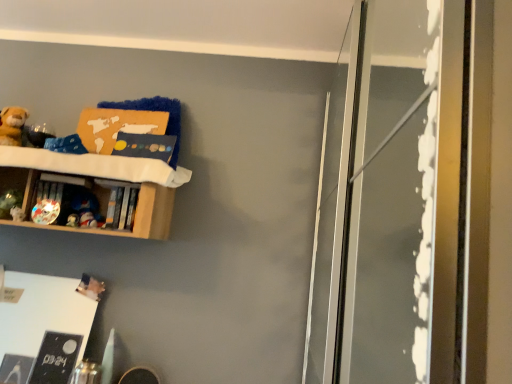
Question: From the image's perspective, is wooden shelf at upper left above white matte board at lower left?

Choices:
 (A) no
 (B) yes

Answer: (B)

Question: Considering the relative sizes of wooden shelf at upper left and white matte board at lower left in the image provided, is wooden shelf at upper left thinner than white matte board at lower left?

Choices:
 (A) yes
 (B) no

Answer: (B)

Question: From the image's perspective, is wooden shelf at upper left below white matte board at lower left?

Choices:
 (A) no
 (B) yes

Answer: (A)

Question: From a real-world perspective, is wooden shelf at upper left on white matte board at lower left?

Choices:
 (A) no
 (B) yes

Answer: (B)

Question: Is white matte board at lower left inside wooden shelf at upper left?

Choices:
 (A) yes
 (B) no

Answer: (B)

Question: Visually, is matte plastic toy at upper left, marked as the first toy in a bottom-to-top arrangement, positioned to the left or to the right of matte plastic toy at left, positioned as the fifth toy in top-to-bottom order?

Choices:
 (A) left
 (B) right

Answer: (B)

Question: Do you think matte plastic toy at upper left, marked as the first toy in a bottom-to-top arrangement, is within matte plastic toy at left, positioned as the fifth toy in top-to-bottom order, or outside of it?

Choices:
 (A) inside
 (B) outside

Answer: (B)

Question: From the image's perspective, is matte plastic toy at upper left, marked as the first toy in a bottom-to-top arrangement, above or below matte plastic toy at left, positioned as the fifth toy in top-to-bottom order?

Choices:
 (A) above
 (B) below

Answer: (B)

Question: Considering the positions of matte plastic toy at upper left, acting as the sixth toy starting from the top, and matte plastic toy at left, positioned as the fifth toy in top-to-bottom order, in the image, is matte plastic toy at upper left, acting as the sixth toy starting from the top, taller or shorter than matte plastic toy at left, positioned as the fifth toy in top-to-bottom order,?

Choices:
 (A) short
 (B) tall

Answer: (A)

Question: Is point (10, 114) positioned closer to the camera than point (40, 218)?

Choices:
 (A) closer
 (B) farther

Answer: (B)

Question: In terms of height, does soft plush bear at upper left, the sixth toy when ordered from bottom to top, look taller or shorter compared to shiny metallic toy at left, the 2th toy when ordered from top to bottom?

Choices:
 (A) tall
 (B) short

Answer: (A)

Question: Considering the positions of soft plush bear at upper left, which ranks as the 1th toy in top-to-bottom order, and shiny metallic toy at left, arranged as the 5th toy when ordered from the bottom, in the image, is soft plush bear at upper left, which ranks as the 1th toy in top-to-bottom order, bigger or smaller than shiny metallic toy at left, arranged as the 5th toy when ordered from the bottom,?

Choices:
 (A) big
 (B) small

Answer: (A)

Question: From a real-world perspective, is soft plush bear at upper left, which ranks as the 1th toy in top-to-bottom order, positioned above or below shiny metallic toy at left, the 2th toy when ordered from top to bottom?

Choices:
 (A) above
 (B) below

Answer: (A)

Question: In terms of height, does transparent glass screen door at right look taller or shorter compared to matte plastic toy at left, the fourth toy in the top-to-bottom sequence?

Choices:
 (A) short
 (B) tall

Answer: (B)

Question: Relative to matte plastic toy at left, the fourth toy in the top-to-bottom sequence, is transparent glass screen door at right in front or behind?

Choices:
 (A) front
 (B) behind

Answer: (A)